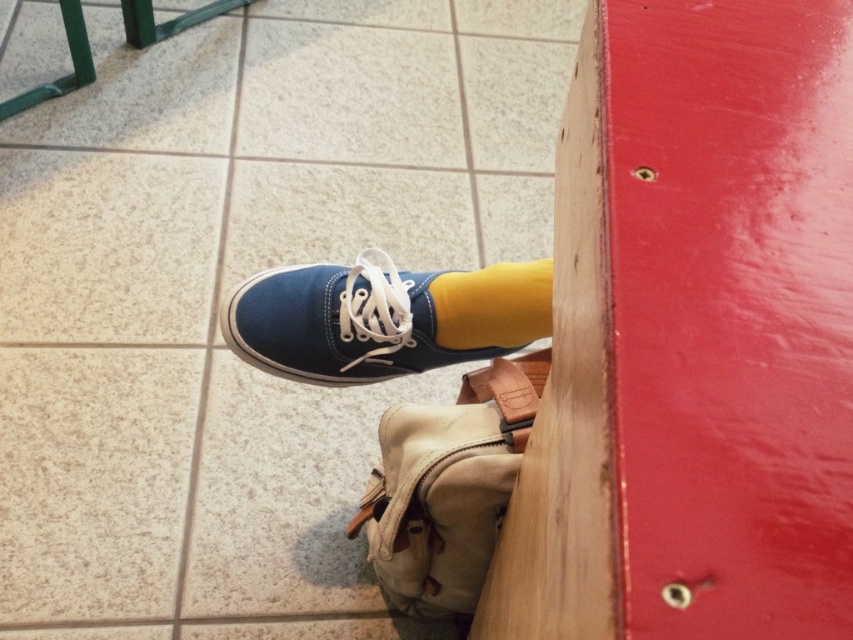
Question: Which point appears closest to the camera in this image?

Choices:
 (A) (299, 369)
 (B) (479, 312)

Answer: (B)

Question: Does blue canvas shoe at center appear over yellow cotton sock at center?

Choices:
 (A) yes
 (B) no

Answer: (B)

Question: Among these points, which one is nearest to the camera?

Choices:
 (A) (445, 317)
 (B) (457, 278)

Answer: (A)

Question: Can you confirm if blue canvas shoe at center is smaller than yellow cotton sock at center?

Choices:
 (A) yes
 (B) no

Answer: (B)

Question: Is blue canvas shoe at center above yellow cotton sock at center?

Choices:
 (A) yes
 (B) no

Answer: (B)